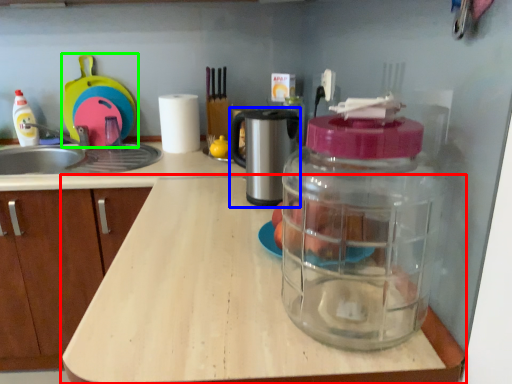
Question: Estimate the real-world distances between objects in this image. Which object is closer to countertop (highlighted by a red box), coffee machine (highlighted by a blue box) or appliance (highlighted by a green box)?

Choices:
 (A) coffee machine
 (B) appliance

Answer: (A)